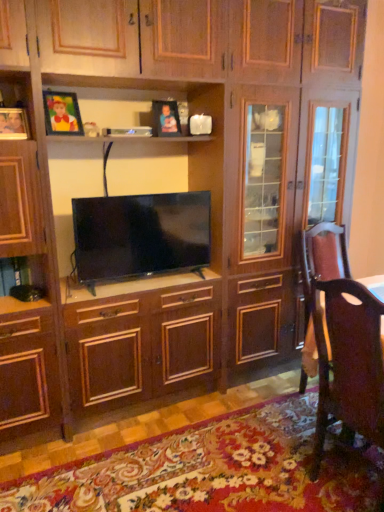
The width and height of the screenshot is (384, 512). What do you see at coordinates (13, 124) in the screenshot? I see `matte wooden picture frame at upper left, the first picture frame when ordered from left to right` at bounding box center [13, 124].

What do you see at coordinates (62, 113) in the screenshot? The width and height of the screenshot is (384, 512). I see `matte wooden picture frame at upper left, the second picture frame when ordered from right to left` at bounding box center [62, 113].

You are a GUI agent. You are given a task and a screenshot of the screen. Output one action in this format:
    pyautogui.click(x=<x>, y=<y>)
    Task: Click on the matte plastic picture frame at upper center, the 1th picture frame when ordered from back to front
    
    Given the screenshot: What is the action you would take?
    pyautogui.click(x=165, y=119)

Is matte black tv at center oriented away from matte plastic picture frame at upper center, arranged as the first picture frame when viewed from the right?

No.

Does matte black tv at center have a greater height compared to matte plastic picture frame at upper center, arranged as the first picture frame when viewed from the right?

Yes.

Which object is positioned more to the left, matte black tv at center or matte plastic picture frame at upper center, arranged as the first picture frame when viewed from the right?

From the viewer's perspective, matte black tv at center appears more on the left side.

Choose the correct answer: Is matte black tv at center inside matte plastic picture frame at upper center, the third picture frame in the left-to-right sequence, or outside it?

matte black tv at center lies outside matte plastic picture frame at upper center, the third picture frame in the left-to-right sequence.

Does point (339, 349) appear closer or farther from the camera than point (17, 112)?

Point (339, 349) is positioned closer to the camera compared to point (17, 112).

From the picture: From a real-world perspective, who is located higher, brown leather chair at lower right or matte wooden picture frame at upper left, arranged as the third picture frame when viewed from the back?

matte wooden picture frame at upper left, arranged as the third picture frame when viewed from the back, is physically above.

Between brown leather chair at lower right and matte wooden picture frame at upper left, arranged as the third picture frame when viewed from the back, which one has less height?

matte wooden picture frame at upper left, arranged as the third picture frame when viewed from the back, is shorter.

Would you consider brown leather chair at lower right to be distant from matte wooden picture frame at upper left, the first picture frame from the front?

Indeed, brown leather chair at lower right is not near matte wooden picture frame at upper left, the first picture frame from the front.

You are a GUI agent. You are given a task and a screenshot of the screen. Output one action in this format:
    pyautogui.click(x=<x>, y=<y>)
    Task: Click on the swivel chair that is behind the matte wooden picture frame at upper left, marked as the second picture frame in a left-to-right arrangement
    The height and width of the screenshot is (512, 384).
    Given the screenshot: What is the action you would take?
    pyautogui.click(x=320, y=278)

Considering the relative sizes of matte wooden picture frame at upper left, the second picture frame when ordered from front to back, and brown leather swivel chair at right in the image provided, is matte wooden picture frame at upper left, the second picture frame when ordered from front to back, bigger than brown leather swivel chair at right?

Actually, matte wooden picture frame at upper left, the second picture frame when ordered from front to back, might be smaller than brown leather swivel chair at right.

Considering the positions of point (45, 99) and point (314, 240), is point (45, 99) closer or farther from the camera than point (314, 240)?

Point (45, 99) appears to be closer to the viewer than point (314, 240).

From the image's perspective, between brown leather swivel chair at right and matte plastic picture frame at upper center, positioned as the third picture frame in front-to-back order, which one is located above?

From the image's view, matte plastic picture frame at upper center, positioned as the third picture frame in front-to-back order, is above.

Is brown leather swivel chair at right smaller than matte plastic picture frame at upper center, the third picture frame in the left-to-right sequence?

No, brown leather swivel chair at right is not smaller than matte plastic picture frame at upper center, the third picture frame in the left-to-right sequence.

Are brown leather swivel chair at right and matte plastic picture frame at upper center, positioned as the third picture frame in front-to-back order, located far from each other?

brown leather swivel chair at right is far away from matte plastic picture frame at upper center, positioned as the third picture frame in front-to-back order.

From the image's perspective, count 2nd picture frames upward from the matte wooden picture frame at upper left, the first picture frame from the front, and point to it. Please provide its 2D coordinates.

[(165, 119)]

Is matte plastic picture frame at upper center, positioned as the third picture frame in front-to-back order, bigger or smaller than matte wooden picture frame at upper left, acting as the 3th picture frame starting from the right?

Considering their sizes, matte plastic picture frame at upper center, positioned as the third picture frame in front-to-back order, takes up more space than matte wooden picture frame at upper left, acting as the 3th picture frame starting from the right.

Is point (176, 120) closer or farther from the camera than point (11, 136)?

Point (176, 120) appears to be farther away from the viewer than point (11, 136).

Considering the relative positions of matte black tv at center and brown leather chair at lower right in the image provided, is matte black tv at center in front of brown leather chair at lower right?

No, matte black tv at center is further to the viewer.

Considering the relative sizes of matte black tv at center and brown leather chair at lower right in the image provided, is matte black tv at center bigger than brown leather chair at lower right?

Incorrect, matte black tv at center is not larger than brown leather chair at lower right.

In terms of height, does matte black tv at center look taller or shorter compared to brown leather chair at lower right?

In the image, matte black tv at center appears to be shorter than brown leather chair at lower right.

Is matte black tv at center oriented towards brown leather chair at lower right?

Yes, matte black tv at center is aimed at brown leather chair at lower right.

Is matte wooden picture frame at upper left, acting as the 3th picture frame starting from the right, wider or thinner than matte black tv at center?

Clearly, matte wooden picture frame at upper left, acting as the 3th picture frame starting from the right, has less width compared to matte black tv at center.

From a real-world perspective, does matte wooden picture frame at upper left, the first picture frame from the front, sit lower than matte black tv at center?

No, from a real-world perspective, matte wooden picture frame at upper left, the first picture frame from the front, is not beneath matte black tv at center.

You are a GUI agent. You are given a task and a screenshot of the screen. Output one action in this format:
    pyautogui.click(x=<x>, y=<y>)
    Task: Click on the picture frame lying behind the matte black tv at center
    
    Given the screenshot: What is the action you would take?
    pyautogui.click(x=165, y=119)

The width and height of the screenshot is (384, 512). In order to click on chair that is below the matte wooden picture frame at upper left, acting as the 3th picture frame starting from the right (from the image's perspective) in this screenshot , I will do `click(349, 362)`.

From the image, which object appears to be farther from brown leather chair at lower right, brown leather swivel chair at right or matte black tv at center?

Among the two, matte black tv at center is located further to brown leather chair at lower right.

Looking at the image, which one is located further to matte plastic picture frame at upper center, arranged as the first picture frame when viewed from the right, brown leather swivel chair at right or matte wooden picture frame at upper left, the second picture frame when ordered from front to back?

brown leather swivel chair at right is positioned further to the anchor matte plastic picture frame at upper center, arranged as the first picture frame when viewed from the right.

Based on the photo, based on their spatial positions, is matte plastic picture frame at upper center, the 1th picture frame when ordered from back to front, or brown leather swivel chair at right closer to brown leather chair at lower right?

brown leather swivel chair at right lies closer to brown leather chair at lower right than the other object.

From the picture: Which object lies nearer to the anchor point matte wooden picture frame at upper left, the second picture frame when ordered from front to back, brown leather chair at lower right or matte plastic picture frame at upper center, the third picture frame in the left-to-right sequence?

The object closer to matte wooden picture frame at upper left, the second picture frame when ordered from front to back, is matte plastic picture frame at upper center, the third picture frame in the left-to-right sequence.

Based on their spatial positions, is matte wooden picture frame at upper left, the first picture frame from the front, or matte black tv at center further from brown leather chair at lower right?

matte wooden picture frame at upper left, the first picture frame from the front, lies further to brown leather chair at lower right than the other object.

From the image, which object appears to be nearer to brown leather chair at lower right, matte wooden picture frame at upper left, the second picture frame when ordered from right to left, or matte black tv at center?

Based on the image, matte black tv at center appears to be nearer to brown leather chair at lower right.

Which object lies nearer to the anchor point brown leather swivel chair at right, brown leather chair at lower right or matte plastic picture frame at upper center, arranged as the first picture frame when viewed from the right?

brown leather chair at lower right is closer to brown leather swivel chair at right.

In the scene shown: Estimate the real-world distances between objects in this image. Which object is further from matte wooden picture frame at upper left, the first picture frame when ordered from left to right, brown leather swivel chair at right or matte plastic picture frame at upper center, positioned as the third picture frame in front-to-back order?

brown leather swivel chair at right is positioned further to the anchor matte wooden picture frame at upper left, the first picture frame when ordered from left to right.

Where is `television between matte wooden picture frame at upper left, marked as the second picture frame in a left-to-right arrangement, and brown leather swivel chair at right from left to right`? Image resolution: width=384 pixels, height=512 pixels. television between matte wooden picture frame at upper left, marked as the second picture frame in a left-to-right arrangement, and brown leather swivel chair at right from left to right is located at coordinates (140, 234).

At what (x,y) coordinates should I click in order to perform the action: click on chair between matte wooden picture frame at upper left, the first picture frame from the front, and brown leather swivel chair at right. Please return your answer as a coordinate pair (x, y). Looking at the image, I should click on (349, 362).

Identify the location of chair between matte wooden picture frame at upper left, marked as the second picture frame in a left-to-right arrangement, and brown leather swivel chair at right from left to right. pyautogui.click(x=349, y=362).

Identify the location of television between matte wooden picture frame at upper left, arranged as the third picture frame when viewed from the back, and brown leather chair at lower right, in the horizontal direction. The width and height of the screenshot is (384, 512). (140, 234).